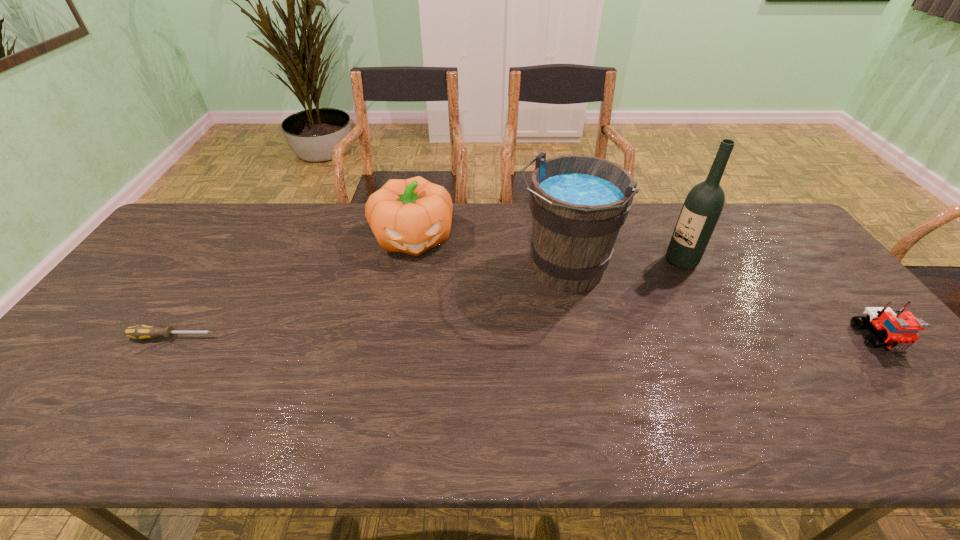
I want to click on free space between the fourth tallest object and the second tallest object, so click(x=721, y=305).

Where is `vacant area that lies between the wine bottle and the shortest object`? The width and height of the screenshot is (960, 540). vacant area that lies between the wine bottle and the shortest object is located at coordinates (427, 299).

Where is `vacant region between the leftmost object and the fourth tallest object`? vacant region between the leftmost object and the fourth tallest object is located at coordinates (525, 338).

What are the coordinates of `blank region between the fourth tallest object and the fourth shortest object` in the screenshot? It's located at (721, 305).

At what (x,y) coordinates should I click in order to perform the action: click on vacant area that lies between the second tallest object and the screwdriver. Please return your answer as a coordinate pair (x, y). The height and width of the screenshot is (540, 960). Looking at the image, I should click on (369, 305).

This screenshot has height=540, width=960. Identify the location of free point between the fourth object from left to right and the Lego. (780, 300).

Where is `vacant point located between the third shortest object and the shortest object`? The height and width of the screenshot is (540, 960). vacant point located between the third shortest object and the shortest object is located at coordinates pos(292,287).

What are the coordinates of `vacant area that lies between the rightmost object and the shortest object` in the screenshot? It's located at (525, 338).

Locate which object ranks fourth in proximity to the second tallest object. Please provide its 2D coordinates. Your answer should be formatted as a tuple, i.e. [(x, y)], where the tuple contains the x and y coordinates of a point satisfying the conditions above.

[(140, 332)]

Locate an element on the screen. The image size is (960, 540). object that is the second closest to the wine bottle is located at coordinates (898, 330).